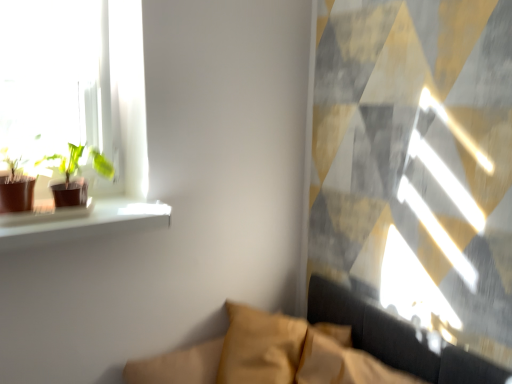
Question: Considering the relative sizes of matte brown pot at left, the 1th houseplant in the left-to-right sequence, and velvet mustard couch at lower center in the image provided, is matte brown pot at left, the 1th houseplant in the left-to-right sequence, bigger than velvet mustard couch at lower center?

Choices:
 (A) no
 (B) yes

Answer: (A)

Question: Is matte brown pot at left, which is the 2th houseplant from right to left, positioned beyond the bounds of velvet mustard couch at lower center?

Choices:
 (A) yes
 (B) no

Answer: (A)

Question: Is matte brown pot at left, the 1th houseplant in the left-to-right sequence, facing towards velvet mustard couch at lower center?

Choices:
 (A) no
 (B) yes

Answer: (A)

Question: Is matte brown pot at left, which is the 2th houseplant from right to left, oriented away from velvet mustard couch at lower center?

Choices:
 (A) no
 (B) yes

Answer: (A)

Question: From a real-world perspective, does matte brown pot at left, the 1th houseplant in the left-to-right sequence, sit lower than velvet mustard couch at lower center?

Choices:
 (A) yes
 (B) no

Answer: (B)

Question: Would you say matte brown pot at left, which is the 2th houseplant from right to left, is inside or outside green matte plant at left, the 2th houseplant from the left?

Choices:
 (A) outside
 (B) inside

Answer: (A)

Question: Does point (12, 195) appear closer or farther from the camera than point (56, 155)?

Choices:
 (A) farther
 (B) closer

Answer: (B)

Question: Based on their sizes in the image, would you say matte brown pot at left, the 1th houseplant in the left-to-right sequence, is bigger or smaller than green matte plant at left, the 1th houseplant viewed from the right?

Choices:
 (A) big
 (B) small

Answer: (B)

Question: Is matte brown pot at left, the 1th houseplant in the left-to-right sequence, wider or thinner than green matte plant at left, the 2th houseplant from the left?

Choices:
 (A) wide
 (B) thin

Answer: (B)

Question: In terms of height, does velvet mustard couch at lower center look taller or shorter compared to matte brown pot at left, the 1th houseplant in the left-to-right sequence?

Choices:
 (A) short
 (B) tall

Answer: (B)

Question: Would you say velvet mustard couch at lower center is inside or outside matte brown pot at left, the 1th houseplant in the left-to-right sequence?

Choices:
 (A) inside
 (B) outside

Answer: (B)

Question: From the image's perspective, is velvet mustard couch at lower center located above or below matte brown pot at left, which is the 2th houseplant from right to left?

Choices:
 (A) below
 (B) above

Answer: (A)

Question: Is velvet mustard couch at lower center bigger or smaller than matte brown pot at left, the 1th houseplant in the left-to-right sequence?

Choices:
 (A) big
 (B) small

Answer: (A)

Question: From a real-world perspective, is green matte plant at left, the 2th houseplant from the left, above or below matte brown pot at left, which is the 2th houseplant from right to left?

Choices:
 (A) below
 (B) above

Answer: (A)

Question: In the image, is green matte plant at left, the 1th houseplant viewed from the right, positioned in front of or behind matte brown pot at left, the 1th houseplant in the left-to-right sequence?

Choices:
 (A) behind
 (B) front

Answer: (A)